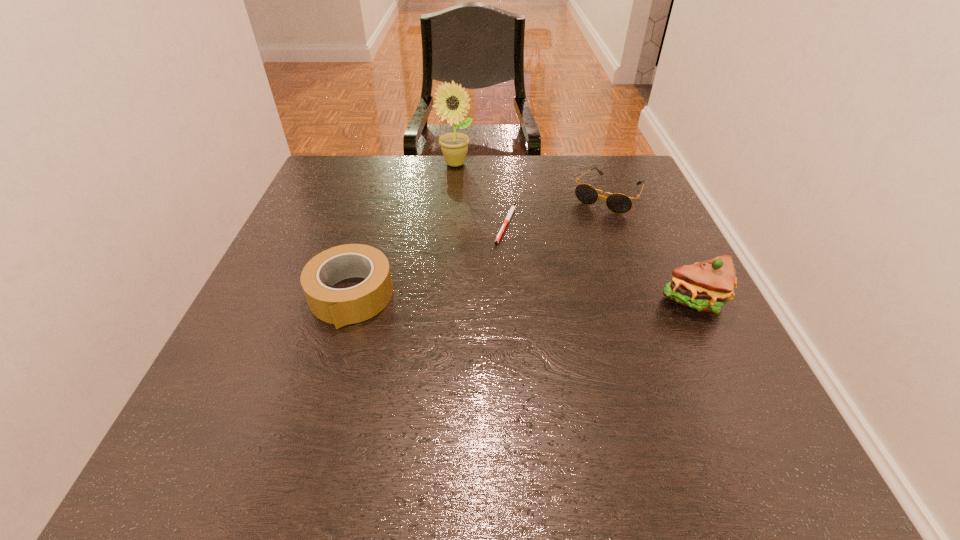
This screenshot has height=540, width=960. I want to click on vacant space that is in between the shortest object and the duct tape, so click(428, 260).

At what (x,y) coordinates should I click in order to perform the action: click on blank region between the second tallest object and the sunglasses. Please return your answer as a coordinate pair (x, y). Looking at the image, I should click on (652, 247).

Locate an element on the screen. Image resolution: width=960 pixels, height=540 pixels. vacant area that lies between the sunglasses and the pen is located at coordinates click(557, 209).

This screenshot has width=960, height=540. Find the location of `vacant region between the shortest object and the sandwich`. vacant region between the shortest object and the sandwich is located at coordinates (601, 262).

I want to click on free space that is in between the third object from right to left and the sunglasses, so click(557, 209).

The height and width of the screenshot is (540, 960). Find the location of `blank region between the third object from left to right and the duct tape`. blank region between the third object from left to right and the duct tape is located at coordinates (428, 260).

I want to click on vacant space that is in between the pen and the duct tape, so click(x=428, y=260).

The image size is (960, 540). Find the location of `empty location between the sandwich and the sunglasses`. empty location between the sandwich and the sunglasses is located at coordinates (652, 247).

Locate an element on the screen. free spot between the duct tape and the sunglasses is located at coordinates (480, 245).

Select which object is the closest to the sunglasses. Please provide its 2D coordinates. Your answer should be formatted as a tuple, i.e. [(x, y)], where the tuple contains the x and y coordinates of a point satisfying the conditions above.

[(512, 208)]